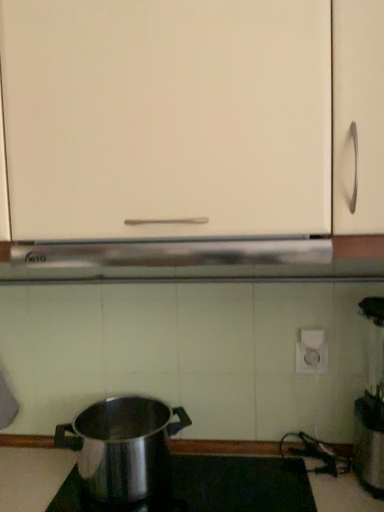
Question: Do you think polished stainless steel pot at lower center is within white matte cabinet at center, or outside of it?

Choices:
 (A) outside
 (B) inside

Answer: (A)

Question: Is polished stainless steel pot at lower center taller or shorter than white matte cabinet at center?

Choices:
 (A) tall
 (B) short

Answer: (B)

Question: Which object is positioned farthest from the polished stainless steel pot at lower center?

Choices:
 (A) white matte cabinet at center
 (B) polished stainless steel pot at lower left

Answer: (A)

Question: Which object is the farthest from the white matte cabinet at center?

Choices:
 (A) polished stainless steel pot at lower left
 (B) polished stainless steel pot at lower center

Answer: (B)